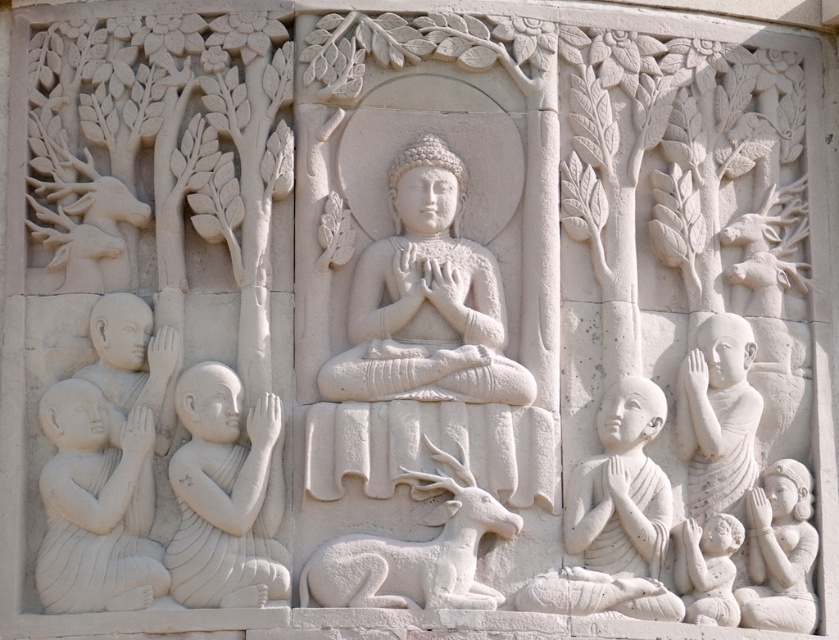
Does white stone child at lower left appear under white stone monk at lower right?

No, white stone child at lower left is not below white stone monk at lower right.

Who is more distant from viewer, [124,454] or [639,490]?

The point [639,490] is behind.

Is point (50, 554) positioned behind point (659, 538)?

No, it is in front of (659, 538).

You are a GUI agent. You are given a task and a screenshot of the screen. Output one action in this format:
    pyautogui.click(x=<x>, y=<y>)
    Task: Click on the white stone child at lower left
    The width and height of the screenshot is (839, 640).
    Given the screenshot: What is the action you would take?
    pyautogui.click(x=94, y=506)

Can you confirm if white stone monk at lower right is positioned below smooth white child at lower right?

Incorrect, white stone monk at lower right is not positioned below smooth white child at lower right.

Who is more forward, (645, 516) or (683, 572)?

Point (645, 516) is more forward.

What do you see at coordinates (621, 486) in the screenshot?
I see `white stone monk at lower right` at bounding box center [621, 486].

What are the coordinates of `white stone monk at lower right` in the screenshot? It's located at (621, 486).

The height and width of the screenshot is (640, 839). Find the location of `white stone figure at lower left`. white stone figure at lower left is located at coordinates (227, 496).

Locate an element on the screen. This screenshot has width=839, height=640. white stone figure at lower left is located at coordinates (227, 496).